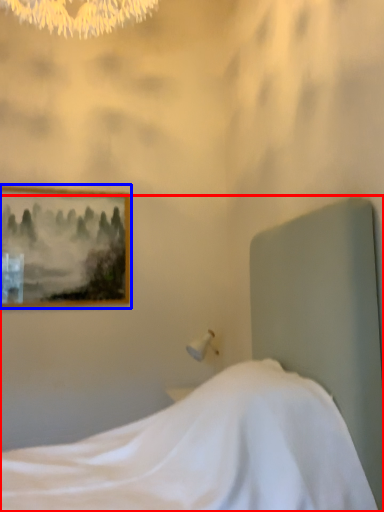
Question: Which point is closer to the camera, bed (highlighted by a red box) or picture frame (highlighted by a blue box)?

Choices:
 (A) bed
 (B) picture frame

Answer: (A)